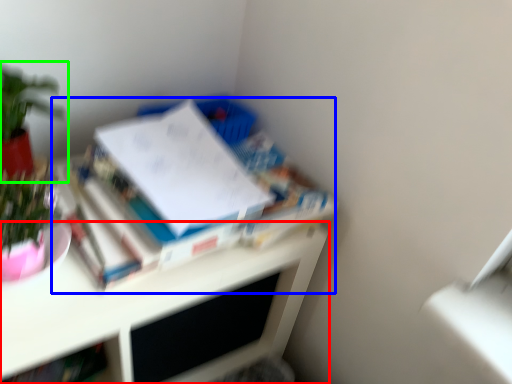
Question: Estimate the real-world distances between objects in this image. Which object is farther from desk (highlighted by a red box), book (highlighted by a blue box) or houseplant (highlighted by a green box)?

Choices:
 (A) book
 (B) houseplant

Answer: (B)